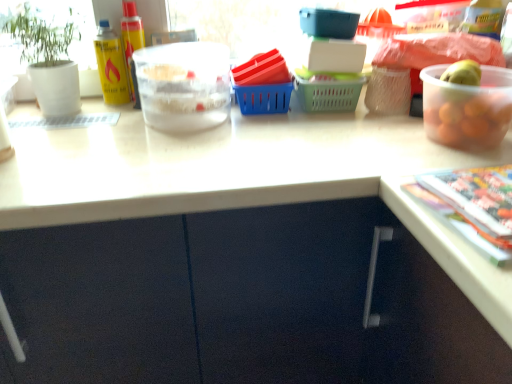
Identify the location of vacant space situated above translucent plastic bowl at upper center, positioned as the 2th bowl in front-to-back order (from a real-world perspective). The width and height of the screenshot is (512, 384). (176, 52).